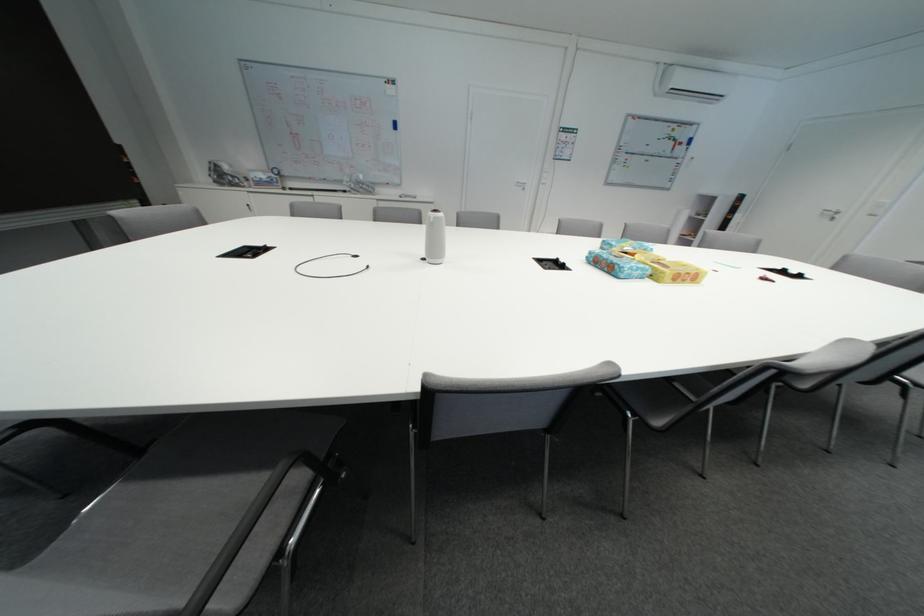
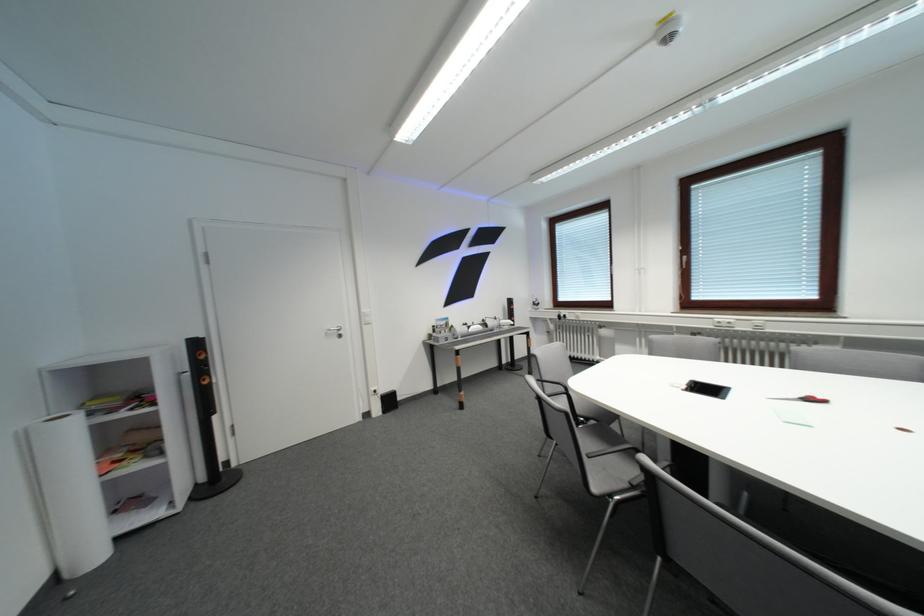
Locate, in the second image, the point that corresponds to [696,217] in the first image.

(82, 432)